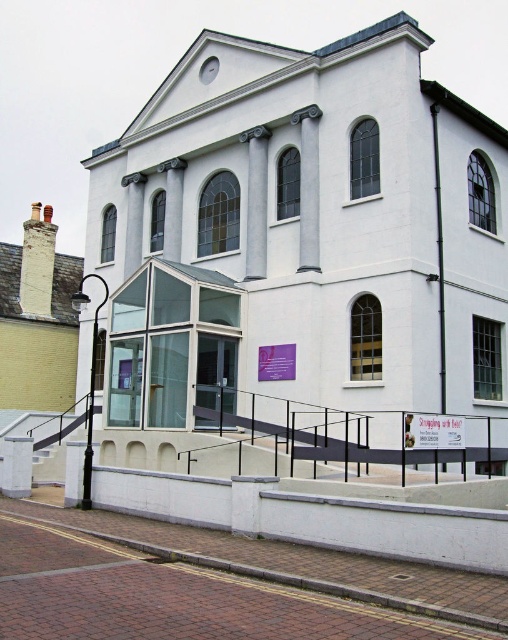
Question: Is white smooth chapel at center above yellow brick chimney at upper left?

Choices:
 (A) yes
 (B) no

Answer: (B)

Question: Is white smooth chapel at center positioned before yellow brick chimney at upper left?

Choices:
 (A) yes
 (B) no

Answer: (A)

Question: From the image, what is the correct spatial relationship of white smooth chapel at center in relation to yellow brick chimney at upper left?

Choices:
 (A) above
 (B) below

Answer: (B)

Question: Which point is closer to the camera?

Choices:
 (A) (461, 256)
 (B) (65, 321)

Answer: (A)